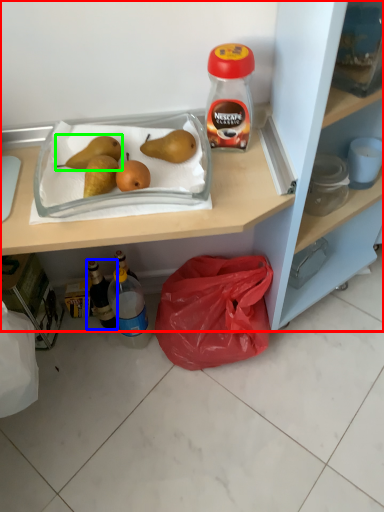
Question: Based on their relative distances, which object is farther from cabinetry (highlighted by a red box)? Choose from bottle (highlighted by a blue box) and pear (highlighted by a green box).

Choices:
 (A) bottle
 (B) pear

Answer: (A)